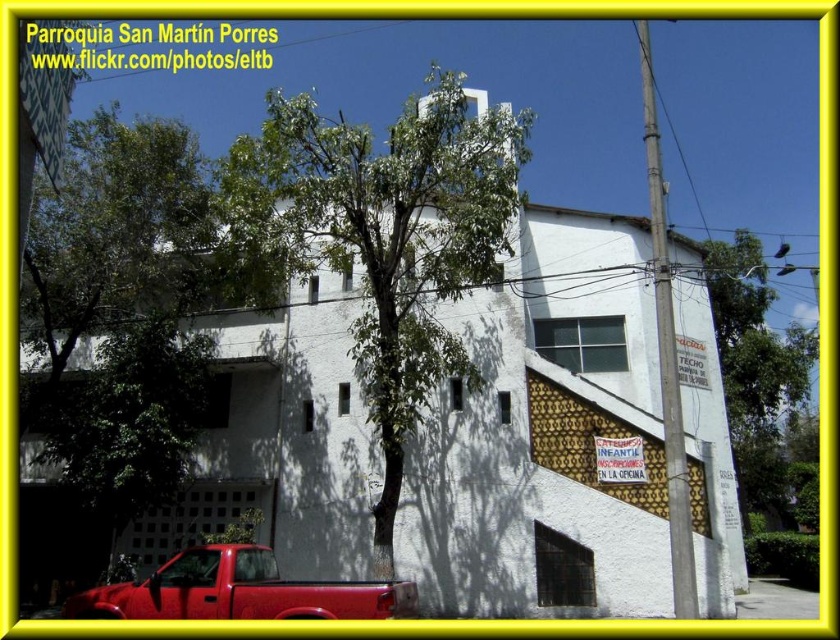
You are standing in front of the Parroquia San Marti Porres building. You see a green leafy tree at right and a shiny red truck at lower left. Which object is located to the right of the other?

The green leafy tree at right is located to the right of the shiny red truck at lower left.